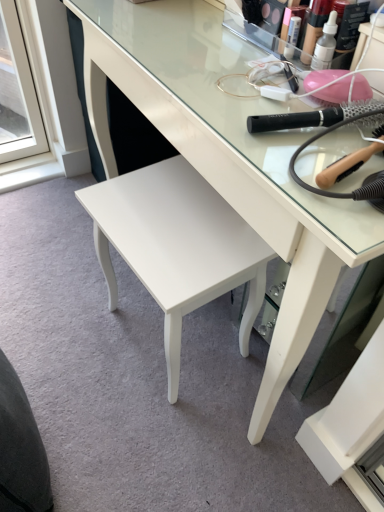
Question: Does dark gray fabric swivel chair at lower left have a greater width compared to white glossy desk at center?

Choices:
 (A) yes
 (B) no

Answer: (B)

Question: Is the depth of dark gray fabric swivel chair at lower left greater than that of white glossy desk at center?

Choices:
 (A) yes
 (B) no

Answer: (A)

Question: Can you confirm if dark gray fabric swivel chair at lower left is shorter than white glossy desk at center?

Choices:
 (A) yes
 (B) no

Answer: (A)

Question: Is dark gray fabric swivel chair at lower left closer to the viewer compared to white glossy desk at center?

Choices:
 (A) yes
 (B) no

Answer: (B)

Question: From the image's perspective, is dark gray fabric swivel chair at lower left on white glossy desk at center?

Choices:
 (A) yes
 (B) no

Answer: (B)

Question: From the image's perspective, would you say dark gray fabric swivel chair at lower left is shown under white glossy desk at center?

Choices:
 (A) no
 (B) yes

Answer: (B)

Question: From a real-world perspective, is dark gray fabric swivel chair at lower left on black plastic hairbrush at upper right, the second brush when ordered from bottom to top?

Choices:
 (A) no
 (B) yes

Answer: (A)

Question: From the image's perspective, is dark gray fabric swivel chair at lower left below black plastic hairbrush at upper right, which is counted as the first brush, starting from the top?

Choices:
 (A) yes
 (B) no

Answer: (A)

Question: Is dark gray fabric swivel chair at lower left not within black plastic hairbrush at upper right, the second brush when ordered from bottom to top?

Choices:
 (A) yes
 (B) no

Answer: (A)

Question: Is dark gray fabric swivel chair at lower left beside black plastic hairbrush at upper right, which is counted as the first brush, starting from the top?

Choices:
 (A) yes
 (B) no

Answer: (B)

Question: From the image's perspective, is dark gray fabric swivel chair at lower left located above black plastic hairbrush at upper right, which is counted as the first brush, starting from the top?

Choices:
 (A) no
 (B) yes

Answer: (A)

Question: Could you tell me if dark gray fabric swivel chair at lower left is turned towards black plastic hairbrush at upper right, the second brush when ordered from bottom to top?

Choices:
 (A) no
 (B) yes

Answer: (A)

Question: Does wooden-handled hairbrush at upper right, acting as the 1th brush starting from the bottom, have a greater height compared to translucent plastic makeup at upper center?

Choices:
 (A) yes
 (B) no

Answer: (B)